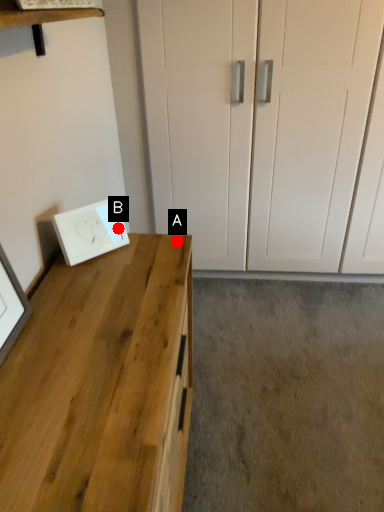
Question: Two points are circled on the image, labeled by A and B beside each circle. Which of the following is the farthest from the observer?

Choices:
 (A) A is further
 (B) B is further

Answer: (B)